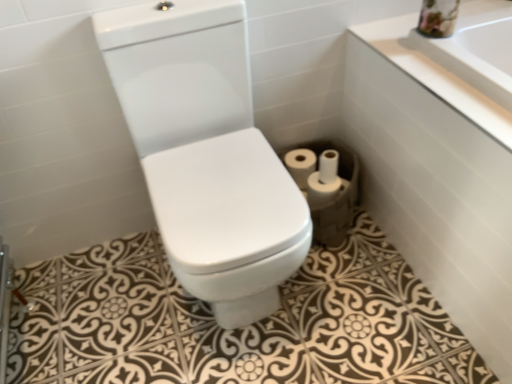
Question: Is white matte toilet paper at center, the 1th toilet paper when ordered from left to right, placed right next to white glossy toilet at center?

Choices:
 (A) yes
 (B) no

Answer: (B)

Question: Is white matte toilet paper at center, the 4th toilet paper in the right-to-left sequence, wider than white glossy toilet at center?

Choices:
 (A) yes
 (B) no

Answer: (B)

Question: Is white matte toilet paper at center, the 1th toilet paper when ordered from left to right, to the left of white glossy toilet at center from the viewer's perspective?

Choices:
 (A) yes
 (B) no

Answer: (B)

Question: Considering the relative positions of white matte toilet paper at center, the 1th toilet paper when ordered from left to right, and white glossy toilet at center in the image provided, is white matte toilet paper at center, the 1th toilet paper when ordered from left to right, to the right of white glossy toilet at center from the viewer's perspective?

Choices:
 (A) no
 (B) yes

Answer: (B)

Question: From the image's perspective, is white matte toilet paper at center, the 4th toilet paper in the right-to-left sequence, located above white glossy toilet at center?

Choices:
 (A) yes
 (B) no

Answer: (A)

Question: Is white matte toilet paper at center, the 1th toilet paper when ordered from left to right, outside white glossy toilet at center?

Choices:
 (A) yes
 (B) no

Answer: (A)

Question: Is the position of white matte toilet paper at center, the 1th toilet paper when ordered from left to right, more distant than that of white matte toilet paper at lower right, marked as the 2th toilet paper in a right-to-left arrangement?

Choices:
 (A) yes
 (B) no

Answer: (A)

Question: Can you confirm if white matte toilet paper at center, the 1th toilet paper when ordered from left to right, is smaller than white matte toilet paper at lower right, acting as the 3th toilet paper starting from the left?

Choices:
 (A) no
 (B) yes

Answer: (A)

Question: Is white matte toilet paper at center, the 4th toilet paper in the right-to-left sequence, positioned far away from white matte toilet paper at lower right, acting as the 3th toilet paper starting from the left?

Choices:
 (A) yes
 (B) no

Answer: (B)

Question: From the image's perspective, is white matte toilet paper at center, the 4th toilet paper in the right-to-left sequence, above white matte toilet paper at lower right, marked as the 2th toilet paper in a right-to-left arrangement?

Choices:
 (A) yes
 (B) no

Answer: (A)

Question: From a real-world perspective, is white matte toilet paper at center, the 1th toilet paper when ordered from left to right, under white matte toilet paper at lower right, acting as the 3th toilet paper starting from the left?

Choices:
 (A) yes
 (B) no

Answer: (A)

Question: Is white matte toilet paper at center, the 1th toilet paper when ordered from left to right, placed right next to white matte toilet paper at lower right, acting as the 3th toilet paper starting from the left?

Choices:
 (A) no
 (B) yes

Answer: (A)

Question: Is white matte toilet paper at center, marked as the fourth toilet paper in a left-to-right arrangement, taller than white matte toilet paper at lower right, the third toilet paper in the right-to-left sequence?

Choices:
 (A) yes
 (B) no

Answer: (A)